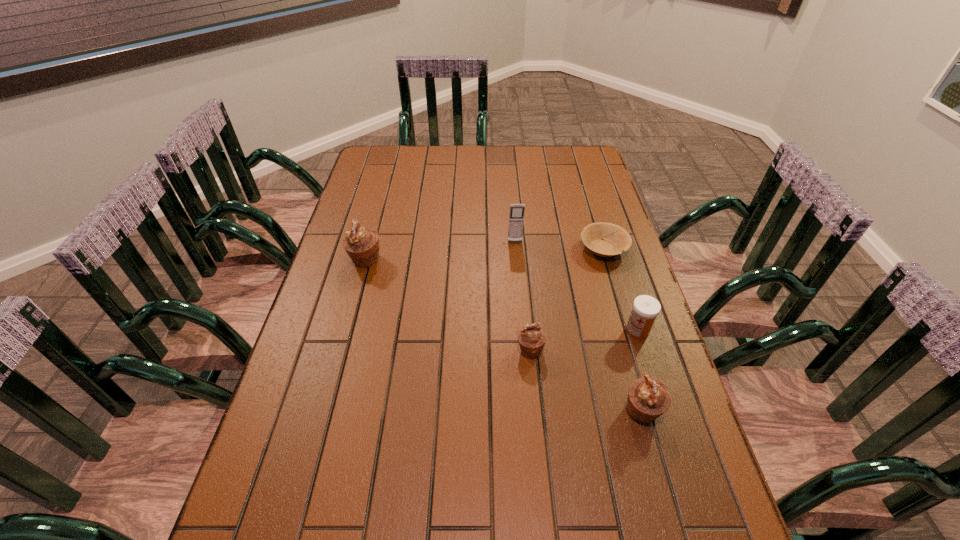
Where is `free space located on the front of the second nearest muffin`? This screenshot has height=540, width=960. free space located on the front of the second nearest muffin is located at coordinates tap(535, 399).

The width and height of the screenshot is (960, 540). Identify the location of free location located on the back of the nearest object. (620, 333).

The height and width of the screenshot is (540, 960). What are the coordinates of `vacant region located 0.170m on the front of the bowl` in the screenshot? It's located at (621, 308).

The image size is (960, 540). I want to click on free space located on the back of the medicine, so click(623, 286).

This screenshot has width=960, height=540. In order to click on vacant position located on the front-facing side of the cellular telephone in this screenshot , I will do [524, 347].

You are a GUI agent. You are given a task and a screenshot of the screen. Output one action in this format:
    pyautogui.click(x=<x>, y=<y>)
    Task: Click on the object that is at the left edge
    
    Given the screenshot: What is the action you would take?
    point(362,245)

Identify the location of muffin located at the right edge. The width and height of the screenshot is (960, 540). (648, 398).

At what (x,y) coordinates should I click in order to perform the action: click on bowl located in the right edge section of the desktop. Please return your answer as a coordinate pair (x, y). This screenshot has width=960, height=540. Looking at the image, I should click on (616, 240).

Identify the location of medicine present at the right edge. (646, 308).

Locate an element on the screen. The height and width of the screenshot is (540, 960). vacant space at the far edge is located at coordinates (452, 168).